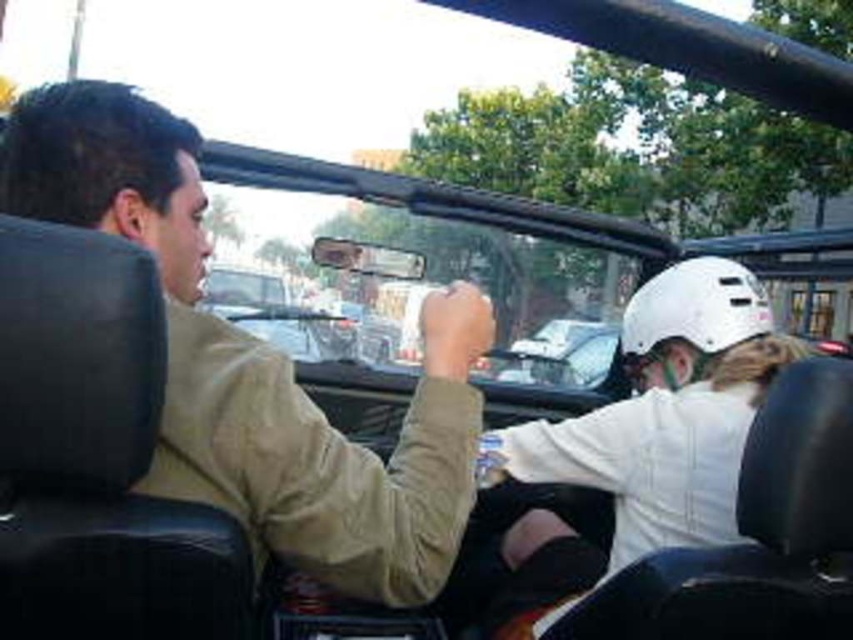
Which is above, khaki cotton shirt at center or white matte helmet at upper right?

khaki cotton shirt at center is above.

Between khaki cotton shirt at center and white matte helmet at upper right, which one appears on the left side from the viewer's perspective?

khaki cotton shirt at center is more to the left.

Locate an element on the screen. The image size is (853, 640). khaki cotton shirt at center is located at coordinates (257, 364).

At what (x,y) coordinates should I click in order to perform the action: click on khaki cotton shirt at center. Please return your answer as a coordinate pair (x, y). This screenshot has width=853, height=640. Looking at the image, I should click on (257, 364).

Who is taller, khakimaterial at left or white matte helmet at upper right?

With more height is white matte helmet at upper right.

Does point (276, 500) come in front of point (769, 340)?

Yes, point (276, 500) is in front of point (769, 340).

Does point (428, 301) lie in front of point (608, 467)?

Yes, point (428, 301) is closer to viewer.

Locate an element on the screen. Image resolution: width=853 pixels, height=640 pixels. khakimaterial at left is located at coordinates (325, 452).

Between khaki cotton shirt at center and khakimaterial at left, which one is positioned higher?

khaki cotton shirt at center

Is khaki cotton shirt at center further to camera compared to khakimaterial at left?

That is False.

The image size is (853, 640). In order to click on khaki cotton shirt at center in this screenshot , I will do `click(257, 364)`.